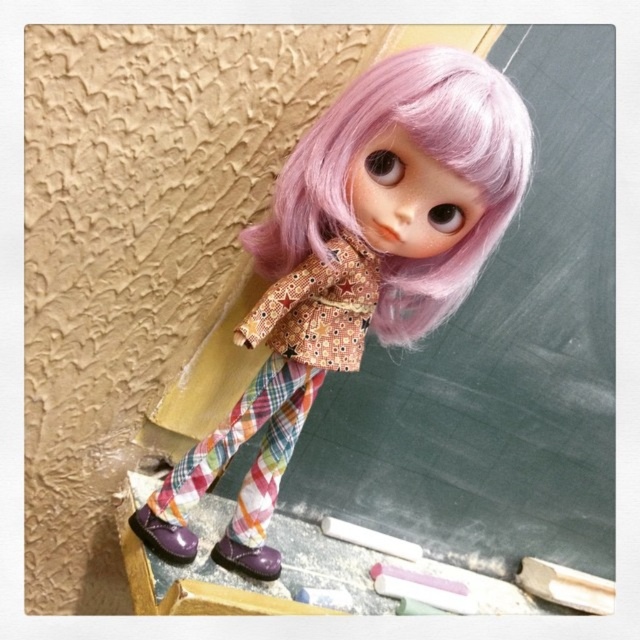
Where is `matte fabric doll at center`? The image size is (640, 640). matte fabric doll at center is located at coordinates (364, 250).

Does matte fabric doll at center have a greater height compared to shiny purple shoe at lower left?

Yes.

Is point (369, 220) positioned after point (195, 544)?

No.

Locate an element on the screen. The image size is (640, 640). matte fabric doll at center is located at coordinates (364, 250).

Which of these two, shiny purple shoe at lower left or purple matte shoe at lower center, stands shorter?

purple matte shoe at lower center

Does point (186, 554) come behind point (220, 556)?

That is False.

Find the location of a particular element. The width and height of the screenshot is (640, 640). shiny purple shoe at lower left is located at coordinates (163, 536).

Between matte fabric doll at center and pastel pink wig at upper center, which one has less height?

pastel pink wig at upper center

How much distance is there between matte fabric doll at center and pastel pink wig at upper center?

A distance of 1.51 inches exists between matte fabric doll at center and pastel pink wig at upper center.

This screenshot has height=640, width=640. What do you see at coordinates (364, 250) in the screenshot?
I see `matte fabric doll at center` at bounding box center [364, 250].

The image size is (640, 640). I want to click on matte fabric doll at center, so click(x=364, y=250).